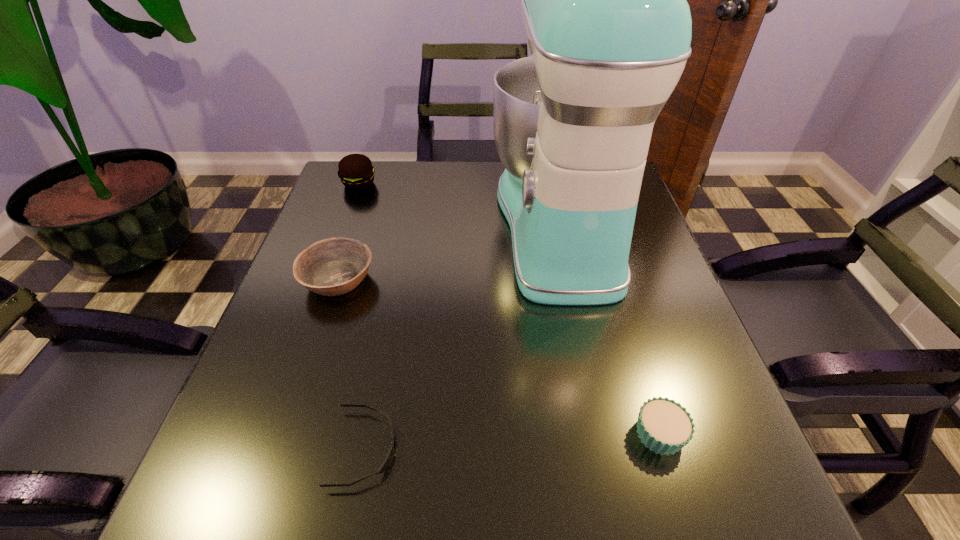
Where is `vacant space that satisfies the following two spatial constraints: 1. at the base of the tallest object; 2. on the back side of the cupcake`? The height and width of the screenshot is (540, 960). vacant space that satisfies the following two spatial constraints: 1. at the base of the tallest object; 2. on the back side of the cupcake is located at coordinates (603, 434).